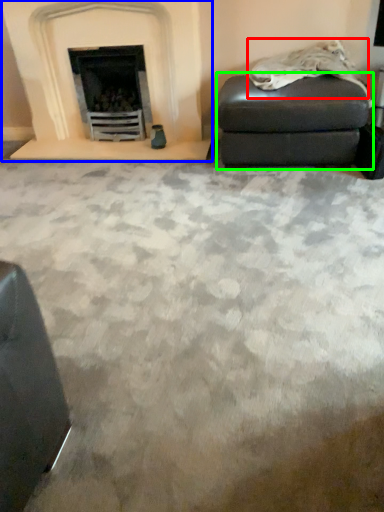
Question: Based on their relative distances, which object is farther from material (highlighted by a red box)? Choose from fireplace (highlighted by a blue box) and stool (highlighted by a green box).

Choices:
 (A) fireplace
 (B) stool

Answer: (A)